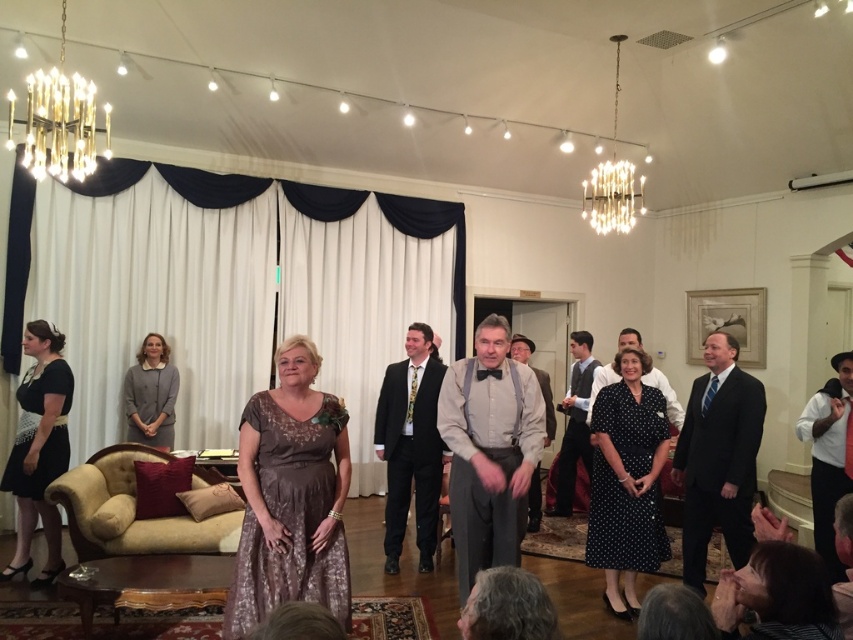
You are a photographer at the event and need to capture both the brown lace dress at center and the white satin bow tie at lower right in a single frame. Which object should you focus on first to ensure both are visible in the photo?

The brown lace dress at center occupies less space than the white satin bow tie at lower right. To ensure both are visible, focus on the white satin bow tie at lower right first since it takes up more space, allowing the smaller brown lace dress at center to fit into the frame more easily.

You are a photographer standing at the center of the room. You want to take a photo of the gold metallic chandelier at upper left and the light beige fabric shirt at center. The camera has a maximum focus range of 3 meters. Can you capture both subjects in focus without moving the camera?

The gold metallic chandelier at upper left is 3.75 meters from the light beige fabric shirt at center. Since the distance between them exceeds the camera maximum focus range of 3 meters, you cannot capture both subjects in focus without moving the camera.